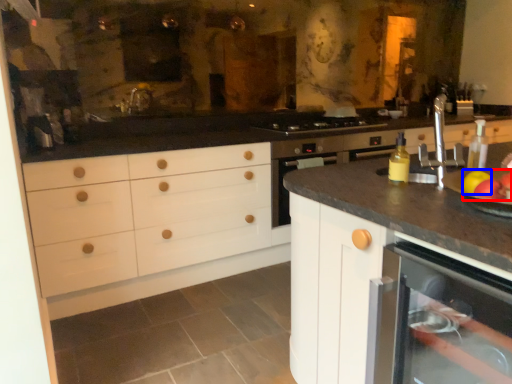
Question: Among these objects, which one is farthest to the camera, apple (highlighted by a red box) or apple (highlighted by a blue box)?

Choices:
 (A) apple
 (B) apple

Answer: (B)